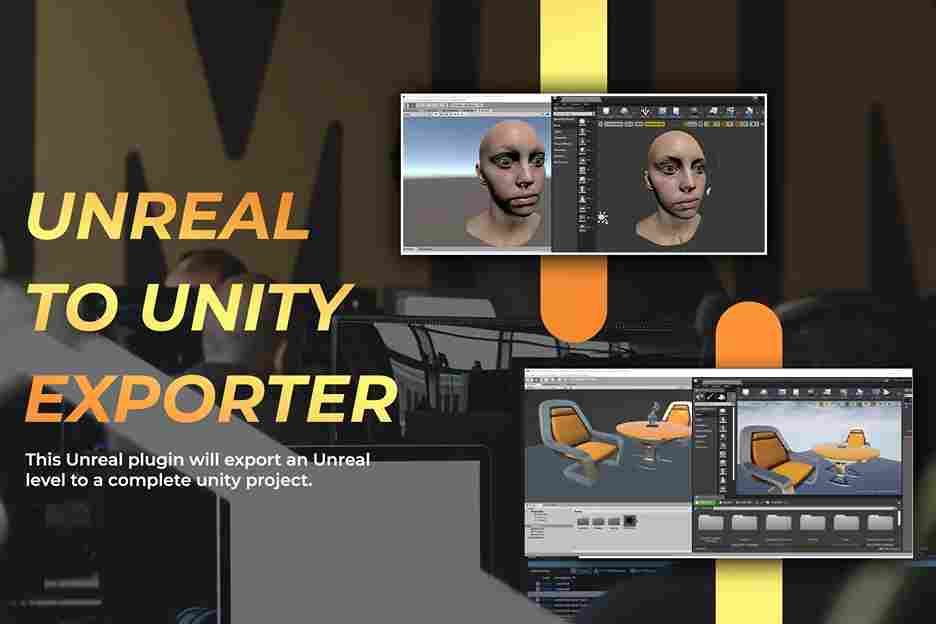
The height and width of the screenshot is (624, 936). I want to click on table, so click(645, 429), click(843, 452).